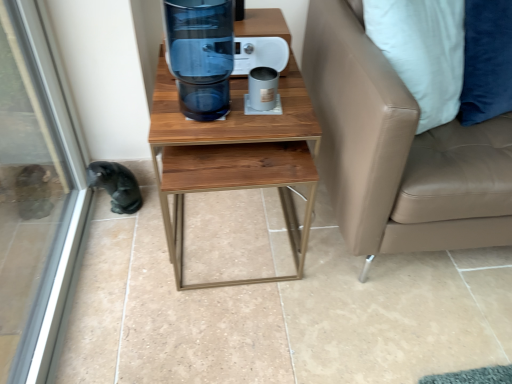
Question: Would you say transparent glass screen door at lower left is to the left or to the right of transparent glass water cooler at center in the picture?

Choices:
 (A) right
 (B) left

Answer: (B)

Question: From a real-world perspective, is transparent glass screen door at lower left positioned above or below transparent glass water cooler at center?

Choices:
 (A) above
 (B) below

Answer: (B)

Question: Which of these objects is positioned farthest from the black fur animal at lower left?

Choices:
 (A) transparent glass screen door at lower left
 (B) wooden table at center
 (C) transparent glass water cooler at center
 (D) tan leather couch at right

Answer: (D)

Question: Based on their relative distances, which object is nearer to the wooden table at center?

Choices:
 (A) transparent glass screen door at lower left
 (B) black fur animal at lower left
 (C) transparent glass water cooler at center
 (D) tan leather couch at right

Answer: (C)